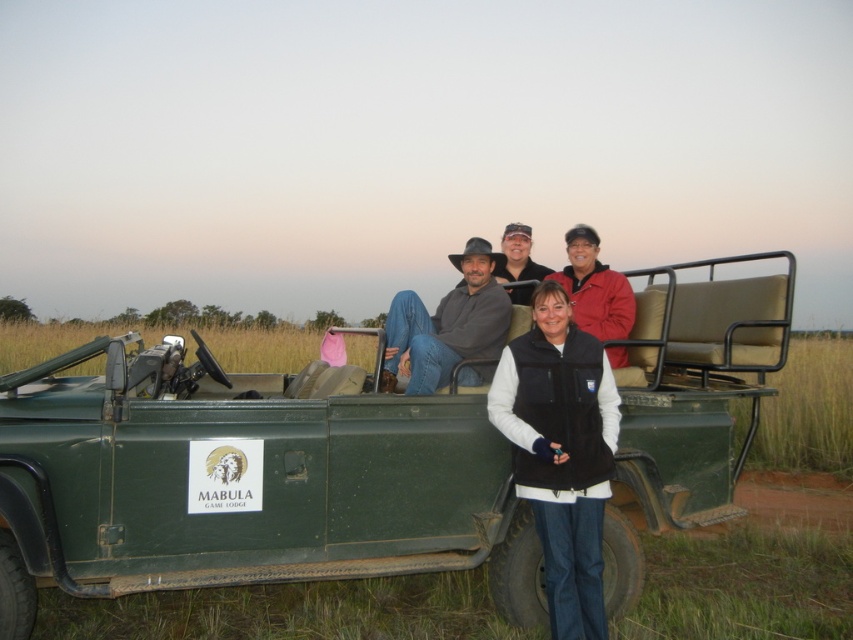
Does denim jeans at center appear under matte gray hat at center?

Indeed, denim jeans at center is positioned under matte gray hat at center.

Does denim jeans at center have a greater height compared to matte gray hat at center?

Yes, denim jeans at center is taller than matte gray hat at center.

This screenshot has width=853, height=640. Find the location of `denim jeans at center`. denim jeans at center is located at coordinates (461, 326).

At what (x,y) coordinates should I click in order to perform the action: click on denim jeans at center. Please return your answer as a coordinate pair (x, y). Looking at the image, I should click on (461, 326).

Is black fleece vest at center below denim jeans at center?

Indeed, black fleece vest at center is positioned under denim jeans at center.

Which is in front, point (596, 552) or point (485, 353)?

Positioned in front is point (596, 552).

Locate an element on the screen. The height and width of the screenshot is (640, 853). black fleece vest at center is located at coordinates (561, 452).

You are a GUI agent. You are given a task and a screenshot of the screen. Output one action in this format:
    pyautogui.click(x=<x>, y=<y>)
    Task: Click on the black fleece vest at center
    
    Given the screenshot: What is the action you would take?
    pyautogui.click(x=561, y=452)

Does black fleece vest at center appear over matte gray hat at center?

No.

Which is behind, point (614, 449) or point (529, 272)?

Point (529, 272)

Locate an element on the screen. The height and width of the screenshot is (640, 853). black fleece vest at center is located at coordinates (561, 452).